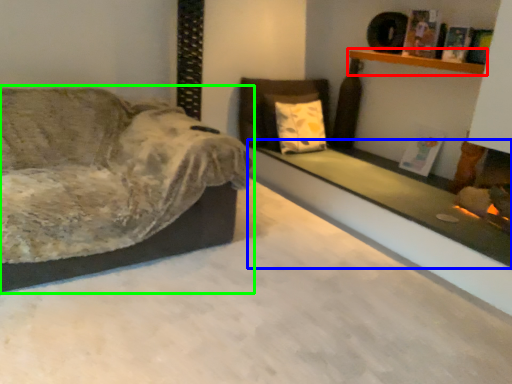
Question: Based on their relative distances, which object is nearer to shelf (highlighted by a red box)? Choose from ledge (highlighted by a blue box) and studio couch (highlighted by a green box).

Choices:
 (A) ledge
 (B) studio couch

Answer: (A)